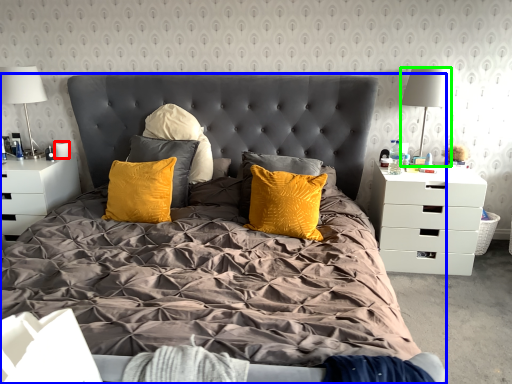
Question: Which object is positioned farthest from coffee cup (highlighted by a red box)? Select from bed (highlighted by a blue box) and lamp (highlighted by a green box).

Choices:
 (A) bed
 (B) lamp

Answer: (B)